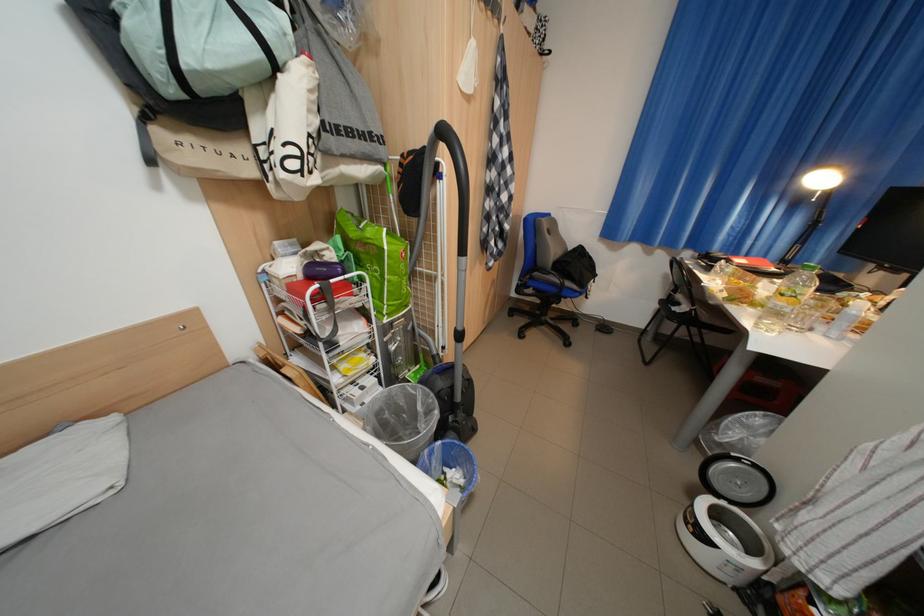
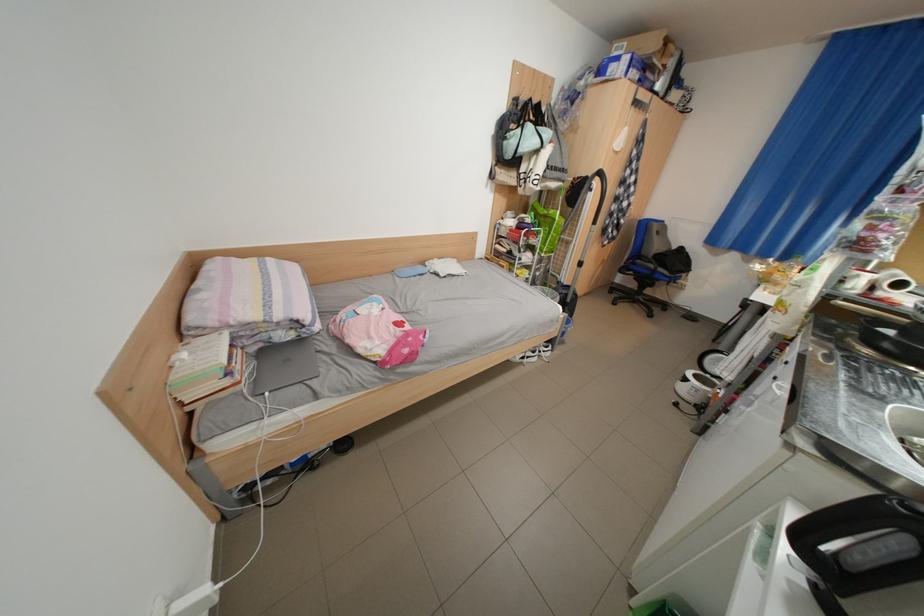
The point at (589, 268) is marked in the first image. Where is the corresponding point in the second image?

(687, 264)